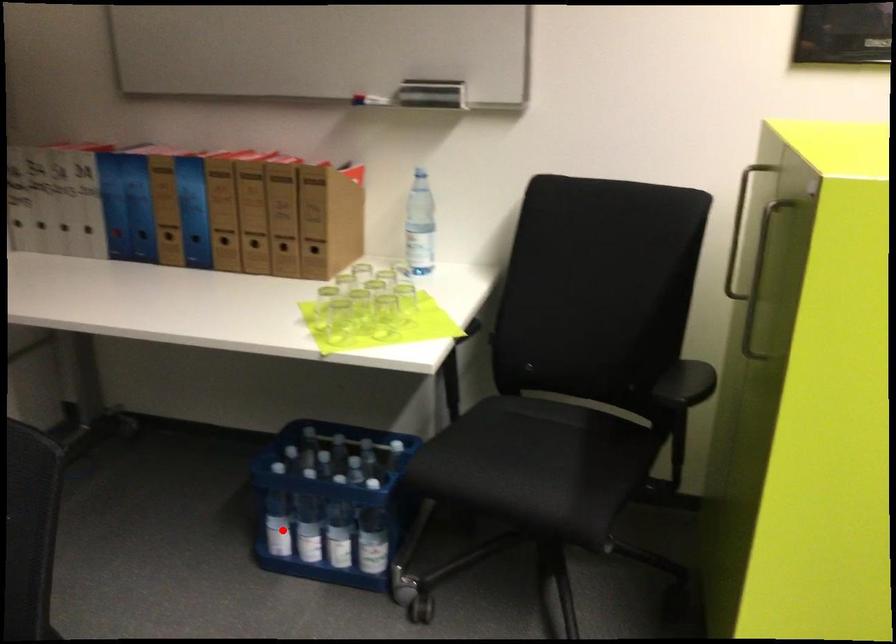
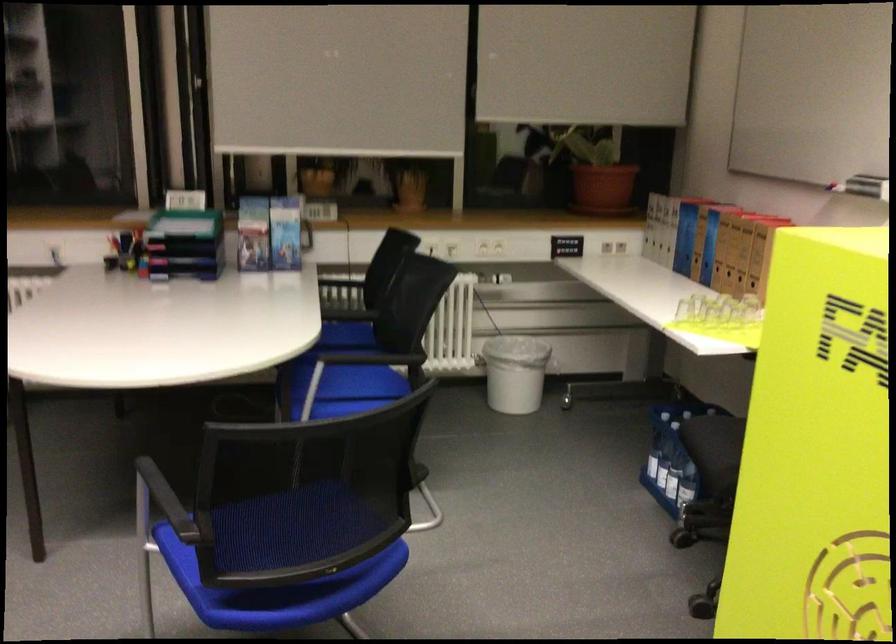
Question: I am providing you with two images of the same scene from different viewpoints. Given a red point in image1, look at the same physical point in image2. Is it:

Choices:
 (A) Closer to the viewpoint
 (B) Farther from the viewpoint

Answer: (B)